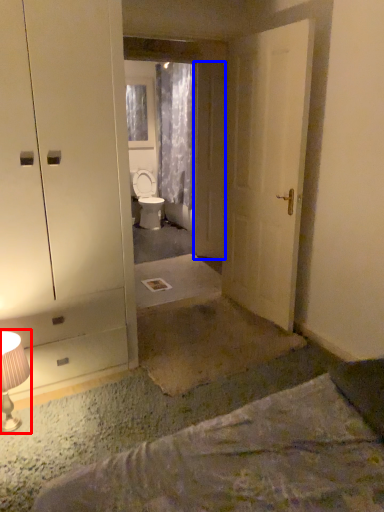
Question: Which object appears closest to the camera in this image, table lamp (highlighted by a red box) or door (highlighted by a blue box)?

Choices:
 (A) table lamp
 (B) door

Answer: (A)